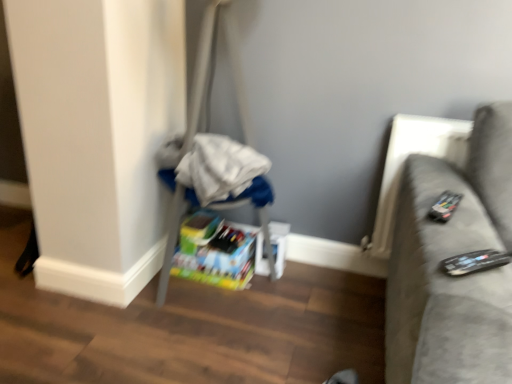
Where is `black plastic remote at right`? The width and height of the screenshot is (512, 384). black plastic remote at right is located at coordinates (474, 262).

Describe the element at coordinates (474, 262) in the screenshot. The width and height of the screenshot is (512, 384). I see `black plastic remote at right` at that location.

Find the location of `black plastic remote at right`. black plastic remote at right is located at coordinates (474, 262).